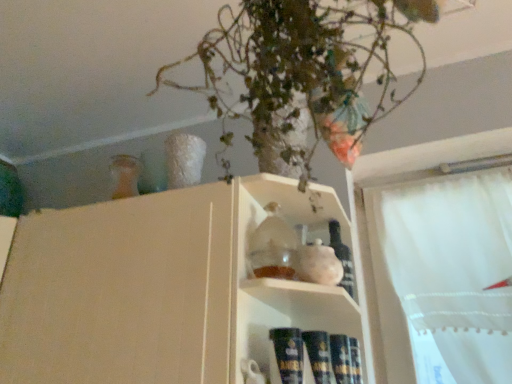
Question: Is translucent glass bottle at shelf center situated inside matte glass jar at center or outside?

Choices:
 (A) inside
 (B) outside

Answer: (A)

Question: From their relative heights in the image, would you say translucent glass bottle at shelf center is taller or shorter than matte glass jar at center?

Choices:
 (A) short
 (B) tall

Answer: (A)

Question: Estimate the real-world distances between objects in this image. Which object is closer to the green leafy plant at upper center?

Choices:
 (A) translucent glass bottle at shelf center
 (B) matte glass jar at center

Answer: (B)

Question: Which of these objects is positioned closest to the green leafy plant at upper center?

Choices:
 (A) translucent glass bottle at shelf center
 (B) matte glass jar at center

Answer: (B)